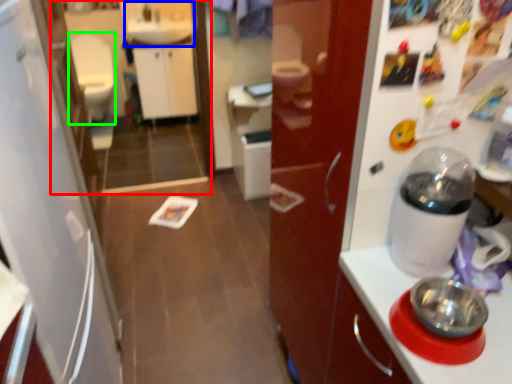
Question: Considering the real-world distances, which object is closest to mirror (highlighted by a red box)? sink (highlighted by a blue box) or toilet bowl (highlighted by a green box).

Choices:
 (A) sink
 (B) toilet bowl

Answer: (A)